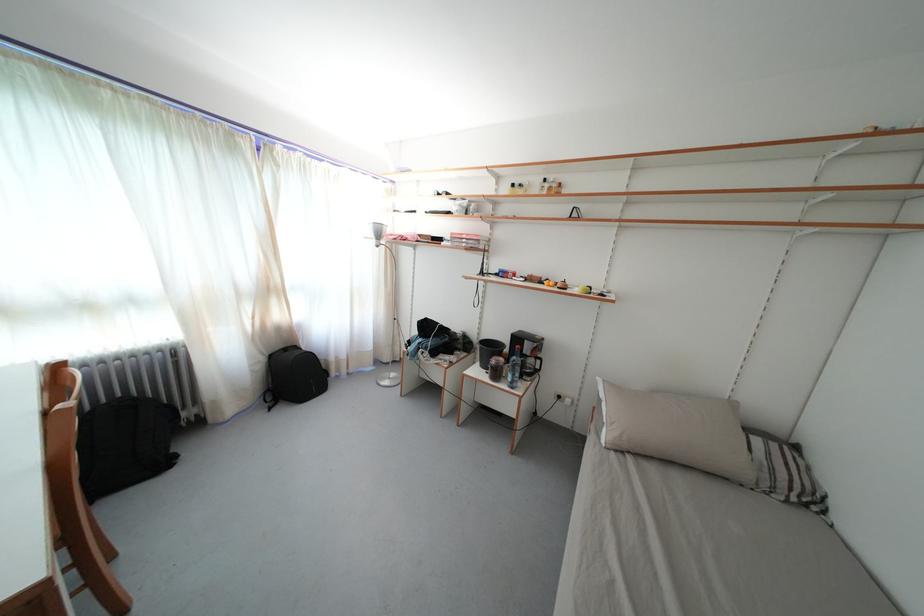
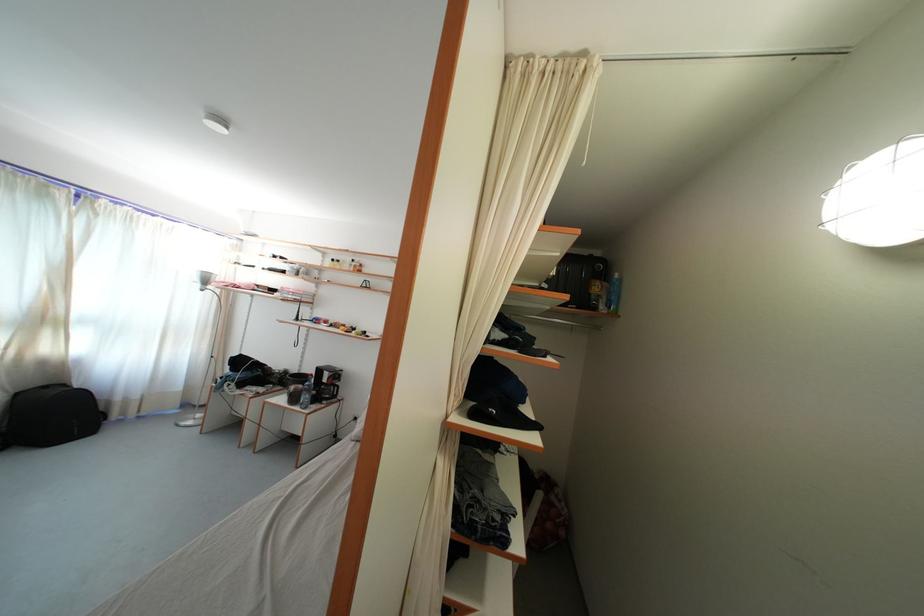
The point at [276,362] is marked in the first image. Where is the corresponding point in the second image?

(23, 400)